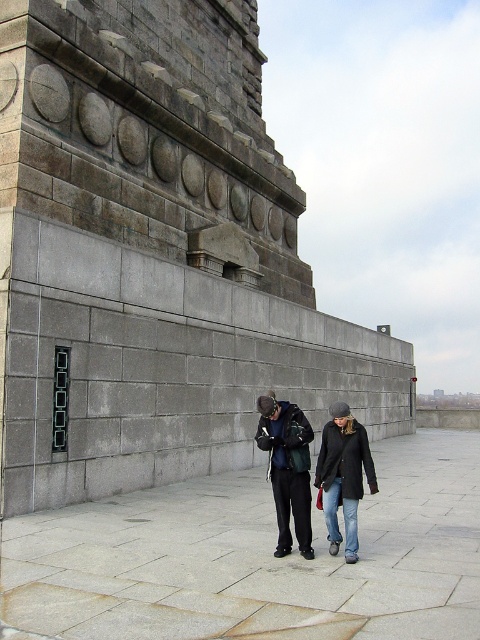
Between dark gray fabric jacket at center and denim jacket at lower right, which one is positioned lower?

denim jacket at lower right is lower down.

Is point (273, 458) less distant than point (364, 440)?

No.

I want to click on dark gray fabric jacket at center, so click(287, 468).

Does point (147, 376) lie behind point (277, 513)?

That is True.

Who is lower down, gray stone monument at center or matte black jacket at center?

matte black jacket at center is lower down.

Measure the distance between point (91, 387) and camera.

Point (91, 387) and camera are 11.95 meters apart.

At what (x,y) coordinates should I click in order to perform the action: click on gray stone monument at center. Please return your answer as a coordinate pair (x, y). This screenshot has height=640, width=480. Looking at the image, I should click on (154, 256).

Which of these two, matte black jacket at center or dark gray fabric jacket at center, stands taller?

matte black jacket at center is taller.

Is matte black jacket at center taller than dark gray fabric jacket at center?

Indeed, matte black jacket at center has a greater height compared to dark gray fabric jacket at center.

Which is in front, point (338, 472) or point (276, 500)?

Point (338, 472)

The image size is (480, 640). Find the location of `matte black jacket at center`. matte black jacket at center is located at coordinates (287, 467).